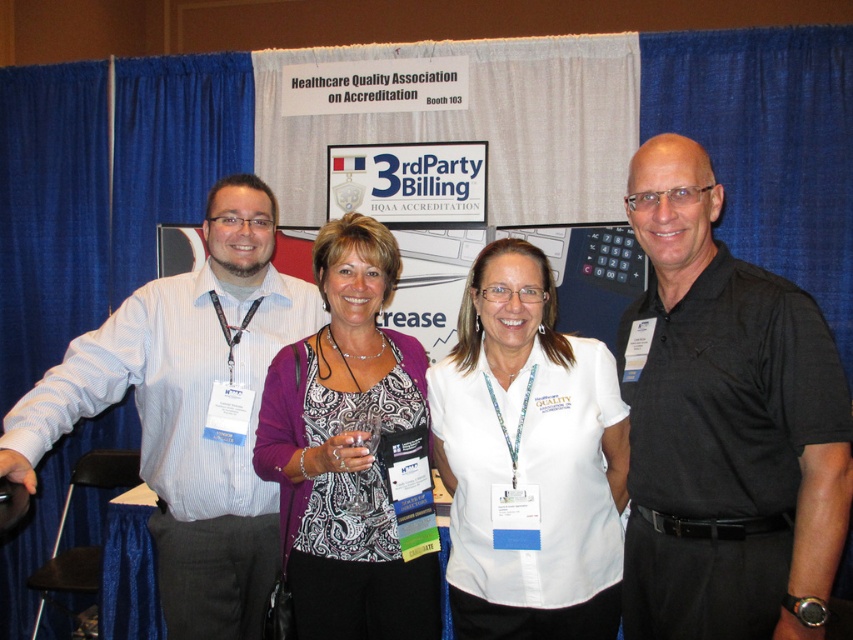
You are standing at the booth and want to place a new sign between the two points, point [753,292] and point [344,369]. Since the sign must be placed equidistant from both points, where should it be positioned?

The sign should be placed at the midpoint between the two points. To calculate this, average the x and y coordinates of both points. The midpoint would be at x coordinate 0.518 and y coordinate 0.644. Therefore, the sign should be placed at point 0.518, 0.644.

You are at a conference and need to locate the person wearing the white striped shirt at center. According to the 2D coordinates provided, where should you look on the screen to find them?

The white striped shirt at center is located at the 2D coordinates point (189, 410) on the screen.